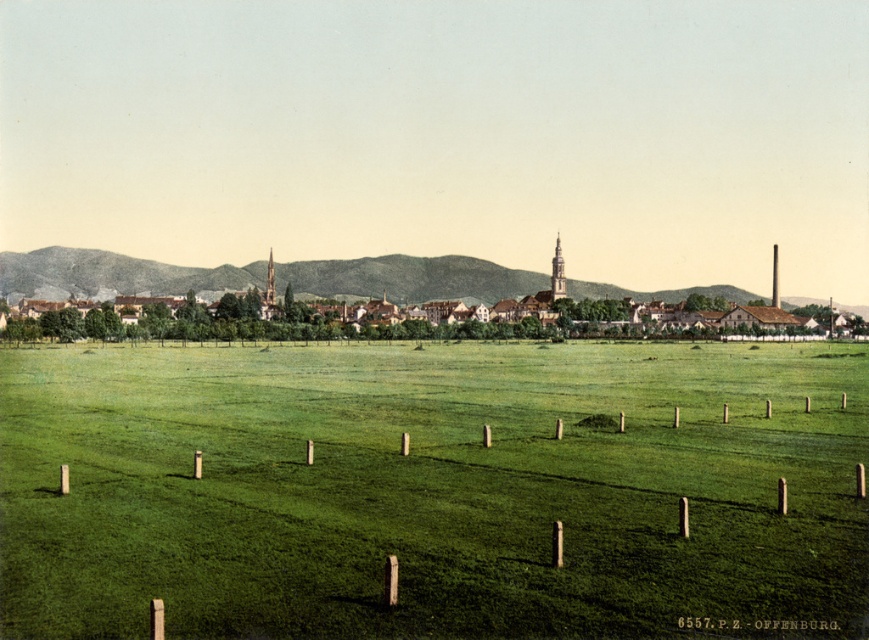
Question: Which point appears farthest from the camera in this image?

Choices:
 (A) (856, 481)
 (B) (523, 276)

Answer: (B)

Question: Is green grass at center positioned in front of brown wooden houses at center?

Choices:
 (A) yes
 (B) no

Answer: (A)

Question: Does brown wooden houses at center have a greater width compared to brown wooden posts at lower center?

Choices:
 (A) yes
 (B) no

Answer: (A)

Question: Which point appears closest to the camera in this image?

Choices:
 (A) pyautogui.click(x=123, y=253)
 (B) pyautogui.click(x=617, y=355)
 (C) pyautogui.click(x=482, y=436)

Answer: (C)

Question: Is green grass at center wider than brown wooden posts at lower center?

Choices:
 (A) yes
 (B) no

Answer: (A)

Question: Which is farther from the brown wooden houses at center?

Choices:
 (A) brown wooden posts at lower center
 (B) green grass at center

Answer: (A)